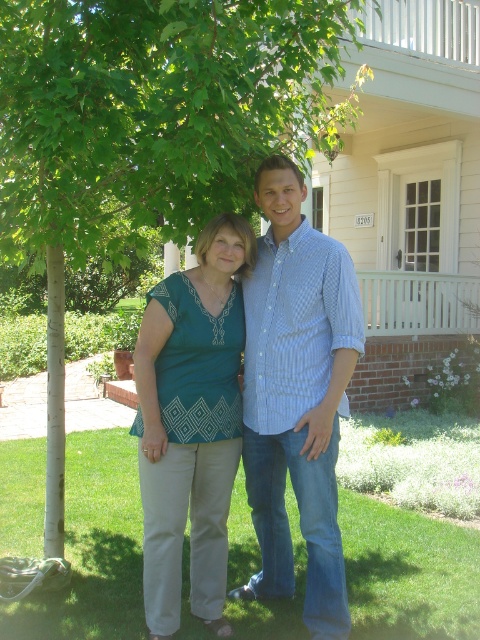
Question: Which object appears closest to the camera in this image?

Choices:
 (A) teal fabric blouse at center
 (B) white painted wood porch at upper right

Answer: (A)

Question: Can you confirm if green leafy tree at upper left is bigger than blue checkered shirt at center?

Choices:
 (A) yes
 (B) no

Answer: (A)

Question: Does green leafy tree at upper left appear on the right side of blue checkered shirt at center?

Choices:
 (A) no
 (B) yes

Answer: (A)

Question: Does green leafy tree at upper left have a larger size compared to teal fabric blouse at center?

Choices:
 (A) yes
 (B) no

Answer: (A)

Question: Among these points, which one is nearest to the camera?

Choices:
 (A) (175, 448)
 (B) (263, 291)
 (C) (380, 320)

Answer: (A)

Question: Which object is farther from the camera taking this photo?

Choices:
 (A) green leafy tree at upper left
 (B) blue checkered shirt at center

Answer: (B)